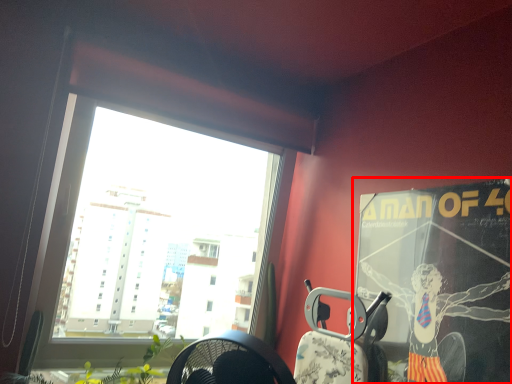
Question: Observing the image, what is the correct spatial positioning of poster page (annotated by the red box) in reference to armchair?

Choices:
 (A) right
 (B) left

Answer: (A)